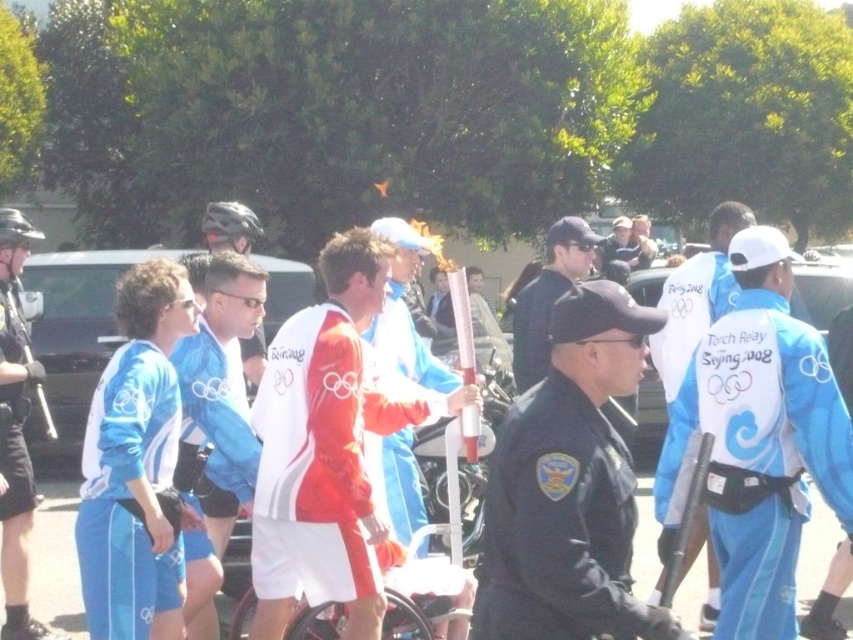
Can you confirm if light blue fabric jacket at center is bigger than dark blue uniform at center?

No.

Between light blue fabric jacket at center and dark blue uniform at center, which one is positioned higher?

dark blue uniform at center is above.

You are a GUI agent. You are given a task and a screenshot of the screen. Output one action in this format:
    pyautogui.click(x=<x>, y=<y>)
    Task: Click on the light blue fabric jacket at center
    This screenshot has width=853, height=640.
    Given the screenshot: What is the action you would take?
    pos(697,296)

Does white fabric jacket at center appear over blue fabric jacket at center?

No.

Who is lower down, white fabric jacket at center or blue fabric jacket at center?

white fabric jacket at center

This screenshot has width=853, height=640. Identify the location of white fabric jacket at center. (323, 449).

Between point (341, 326) and point (25, 403), which one is positioned behind?

Point (25, 403)

Does white fabric jacket at center appear over blue fabric jacket at left?

Correct, white fabric jacket at center is located above blue fabric jacket at left.

Which is in front, point (347, 413) or point (10, 310)?

Point (347, 413)

At what (x,y) coordinates should I click in order to perform the action: click on white fabric jacket at center. Please return your answer as a coordinate pair (x, y). Looking at the image, I should click on (323, 449).